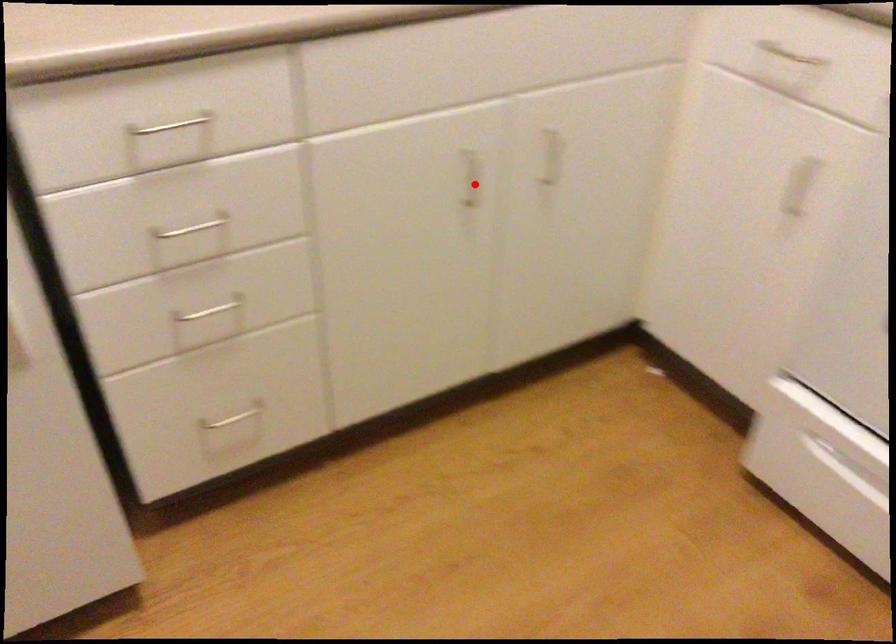
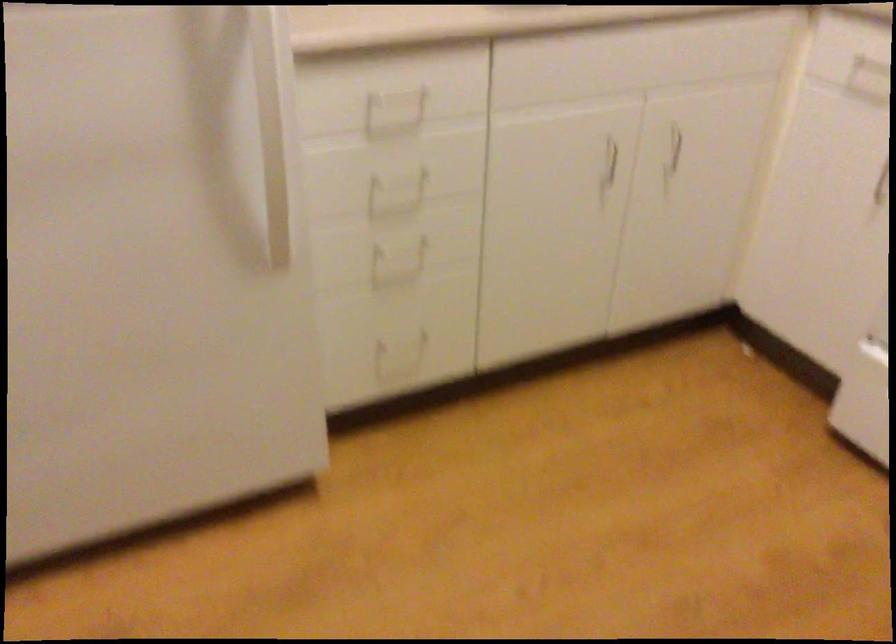
Question: I am providing you with two images of the same scene from different viewpoints. Given a red point in image1, look at the same physical point in image2. Is it:

Choices:
 (A) Closer to the viewpoint
 (B) Farther from the viewpoint

Answer: (B)